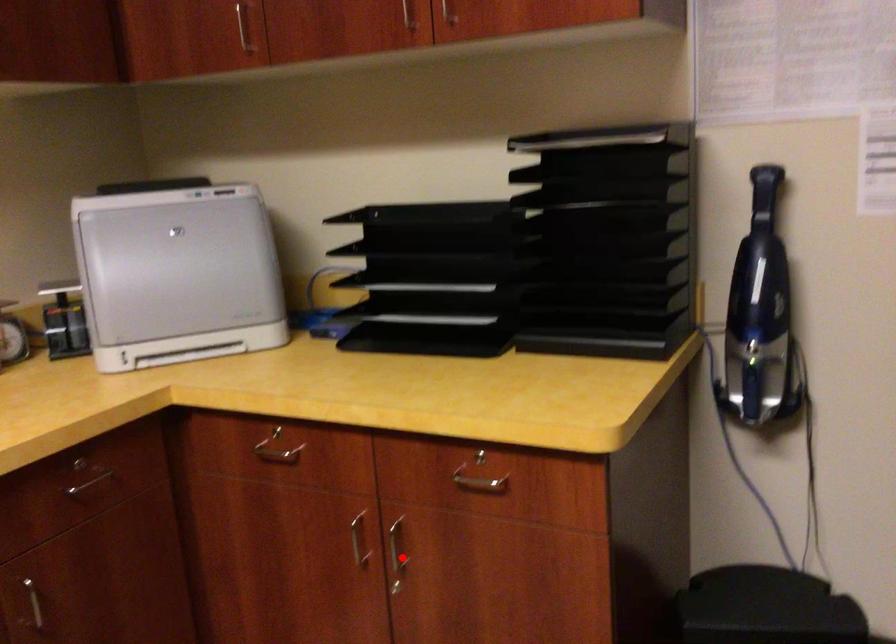
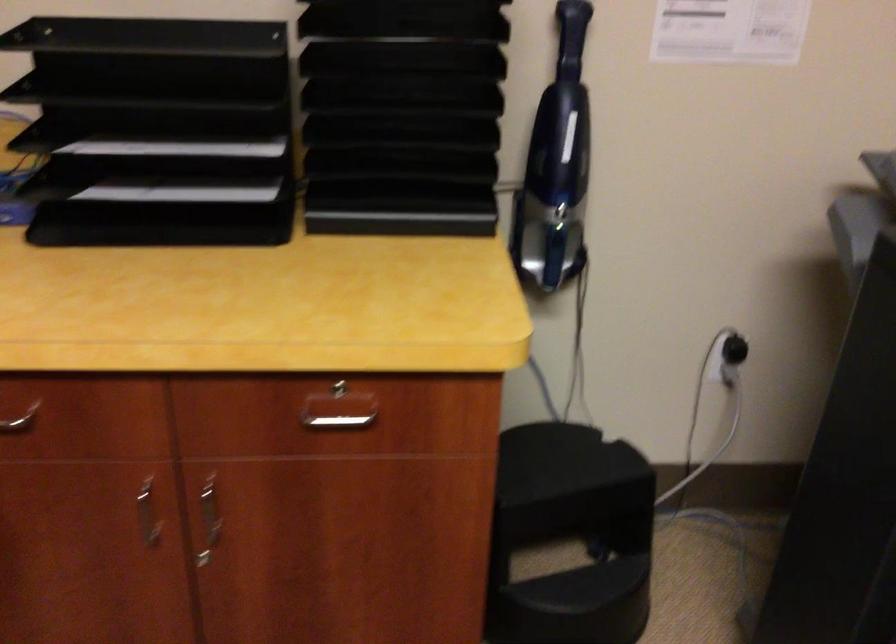
Question: I am providing you with two images of the same scene from different viewpoints. In image1, a red point is highlighted. Considering the same 3D point in image2, which of the following is correct?

Choices:
 (A) It is closer
 (B) It is farther

Answer: (A)